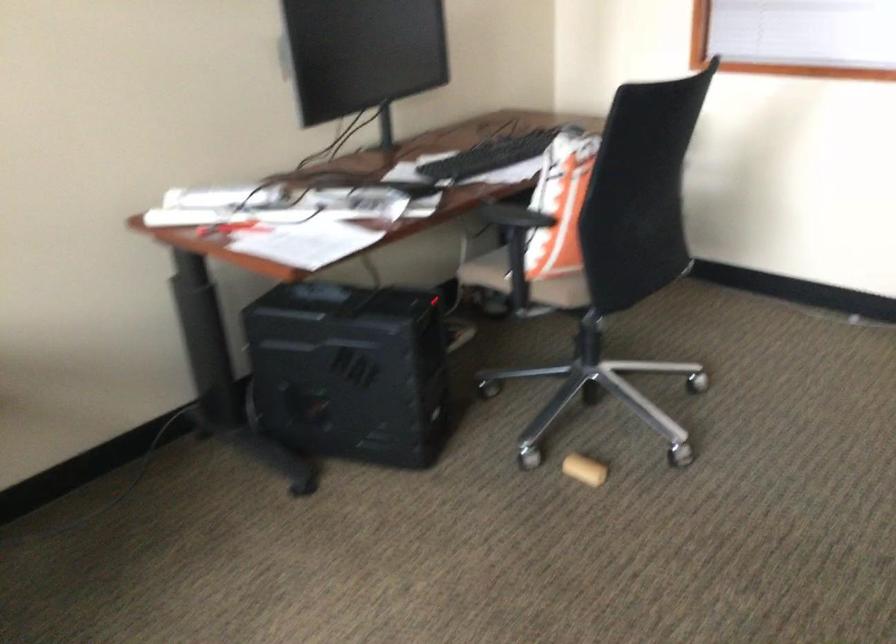
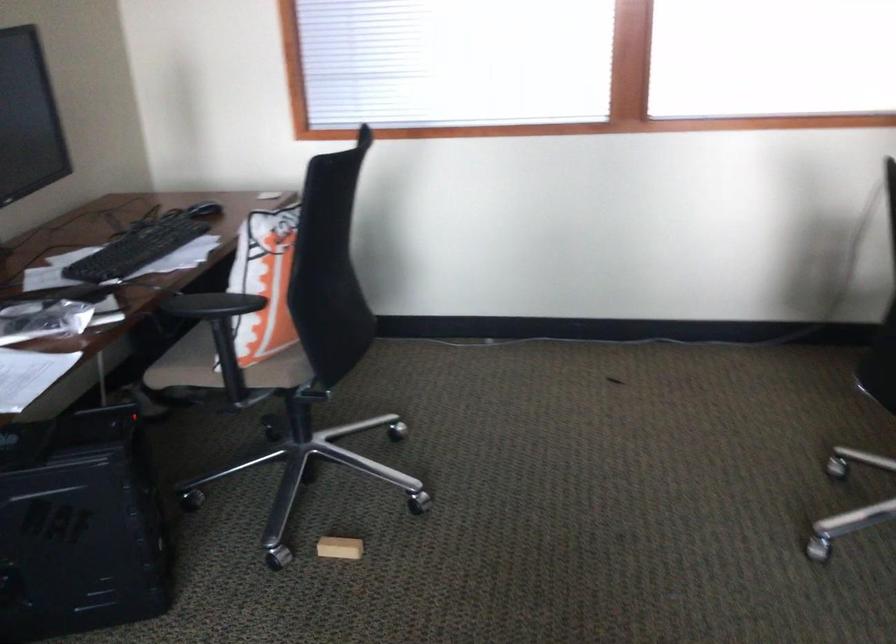
Where in the second image is the point corresponding to the point at 515,279 from the first image?

(228, 370)